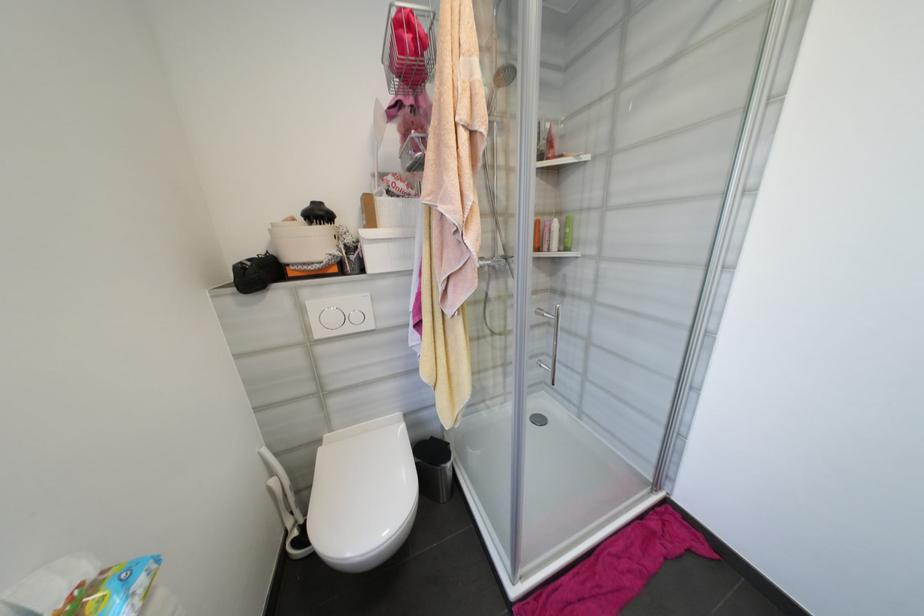
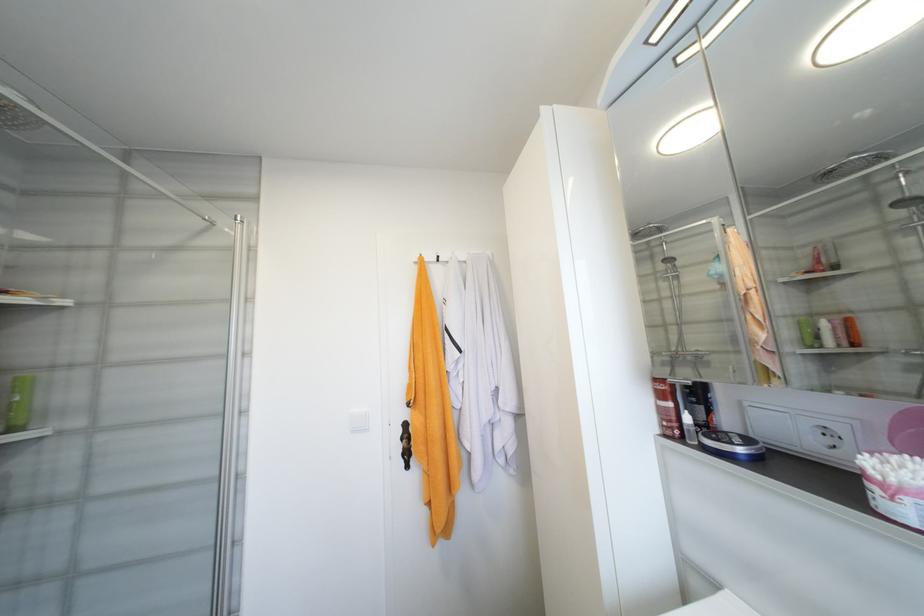
Find the pixel in the second image that matches [572,251] in the first image.

(19, 430)